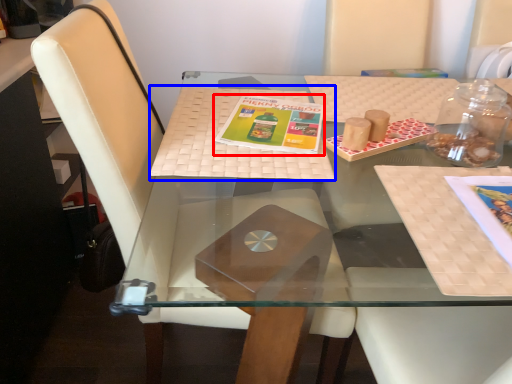
Question: Among these objects, which one is farthest to the camera, book cover (highlighted by a red box) or place mat (highlighted by a blue box)?

Choices:
 (A) book cover
 (B) place mat

Answer: (A)